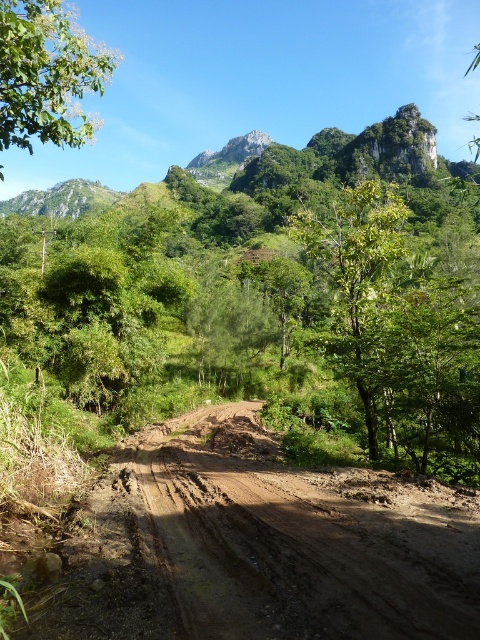
Who is more forward, (400, 576) or (64, 33)?

Point (400, 576)

Can you confirm if brown muddy dirt track at center is taller than green leafy tree at upper left?

No, brown muddy dirt track at center is not taller than green leafy tree at upper left.

Is point (340, 513) positioned behind point (25, 61)?

Yes, point (340, 513) is behind point (25, 61).

You are a GUI agent. You are given a task and a screenshot of the screen. Output one action in this format:
    pyautogui.click(x=<x>, y=<y>)
    Task: Click on the brown muddy dirt track at center
    Image resolution: width=480 pixels, height=640 pixels.
    Given the screenshot: What is the action you would take?
    tap(298, 536)

Is brown muddy dirt track at center taller than green leafy tree at center?

In fact, brown muddy dirt track at center may be shorter than green leafy tree at center.

Who is taller, brown muddy dirt track at center or green leafy tree at center?

Standing taller between the two is green leafy tree at center.

You are a GUI agent. You are given a task and a screenshot of the screen. Output one action in this format:
    pyautogui.click(x=<x>, y=<y>)
    Task: Click on the brown muddy dirt track at center
    Image resolution: width=480 pixels, height=640 pixels.
    Given the screenshot: What is the action you would take?
    pyautogui.click(x=298, y=536)

Does green leafy tree at center have a lesser height compared to green leafy tree at upper left?

Yes, green leafy tree at center is shorter than green leafy tree at upper left.

Describe the element at coordinates (359, 282) in the screenshot. This screenshot has width=480, height=640. I see `green leafy tree at center` at that location.

Locate an element on the screen. This screenshot has width=480, height=640. green leafy tree at center is located at coordinates (359, 282).